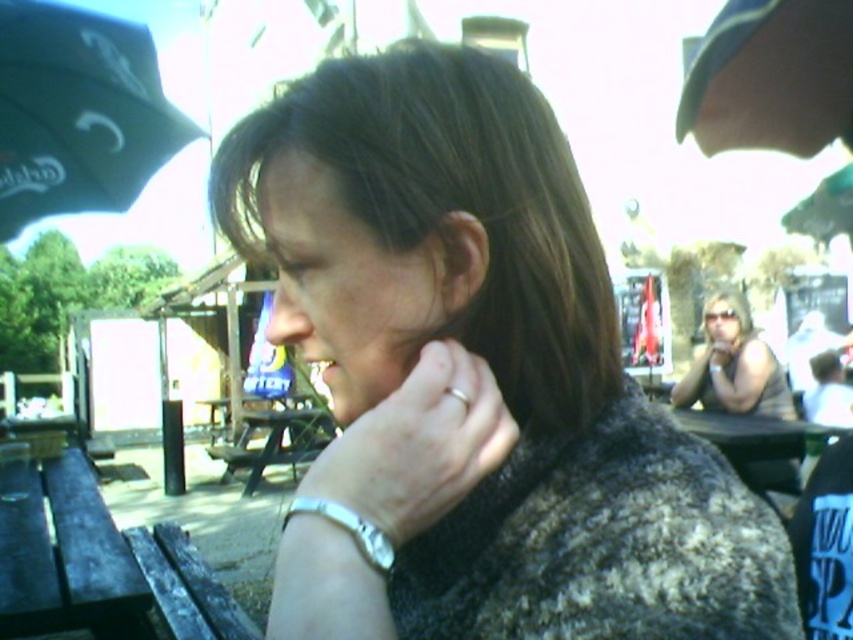
Is dark brown hair at center below black fabric umbrella at upper left?

Yes.

Is point (474, 253) farther from viewer compared to point (183, 136)?

No.

Where is `dark brown hair at center`? This screenshot has height=640, width=853. dark brown hair at center is located at coordinates (477, 378).

Does black fabric umbrella at upper right have a lesser width compared to silver metallic bracelet at lower center?

Yes.

Can you confirm if black fabric umbrella at upper right is bigger than silver metallic bracelet at lower center?

Incorrect, black fabric umbrella at upper right is not larger than silver metallic bracelet at lower center.

What do you see at coordinates (770, 77) in the screenshot? Image resolution: width=853 pixels, height=640 pixels. I see `black fabric umbrella at upper right` at bounding box center [770, 77].

Identify the location of black fabric umbrella at upper right. (770, 77).

Between dark brown hair at center and black fabric umbrella at upper right, which one is positioned lower?

dark brown hair at center is lower down.

Is dark brown hair at center in front of black fabric umbrella at upper right?

That is True.

Who is more forward, (328, 637) or (814, 0)?

Point (328, 637) is more forward.

This screenshot has width=853, height=640. Find the location of `dark brown hair at center`. dark brown hair at center is located at coordinates (477, 378).